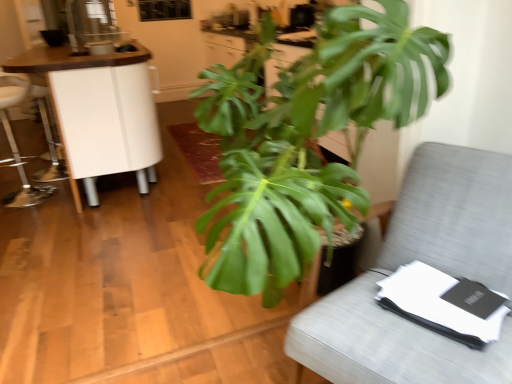
Question: From a real-world perspective, is gray fabric chair at right above or below metallic silver swivel chair at left?

Choices:
 (A) above
 (B) below

Answer: (B)

Question: Looking at the image, does gray fabric chair at right seem bigger or smaller compared to metallic silver swivel chair at left?

Choices:
 (A) small
 (B) big

Answer: (B)

Question: Considering the real-world distances, which object is closest to the white glossy cabinet at left?

Choices:
 (A) green leafy plant at center
 (B) gray fabric chair at right
 (C) metallic silver swivel chair at left

Answer: (C)

Question: Which of these objects is positioned closest to the green leafy plant at center?

Choices:
 (A) gray fabric chair at right
 (B) white glossy cabinet at left
 (C) metallic silver swivel chair at left

Answer: (A)